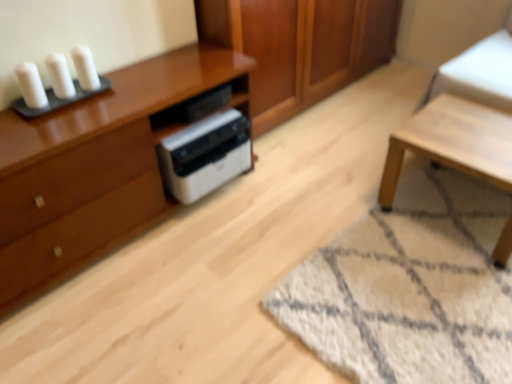
This screenshot has height=384, width=512. I want to click on vacant space to the left of light wood table at lower right, so click(374, 249).